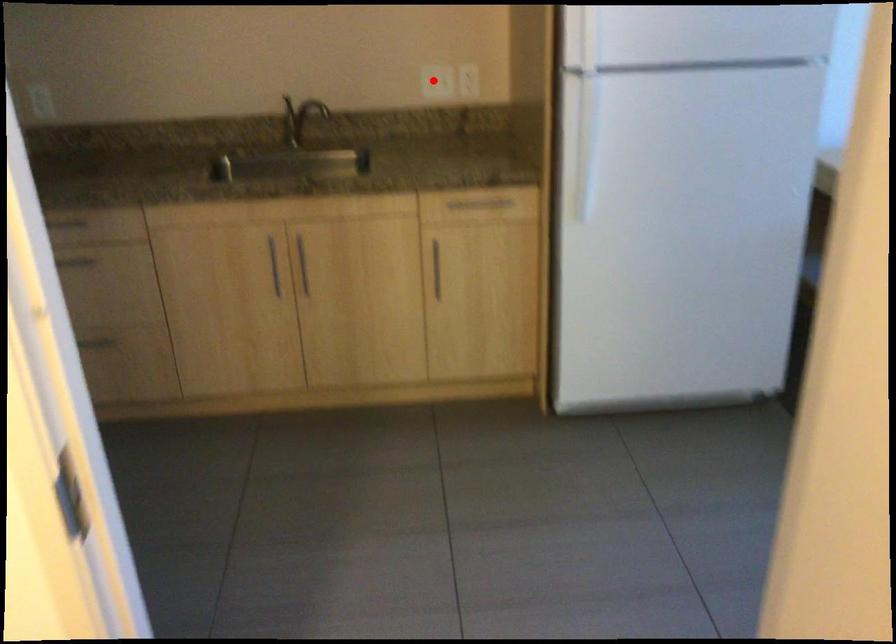
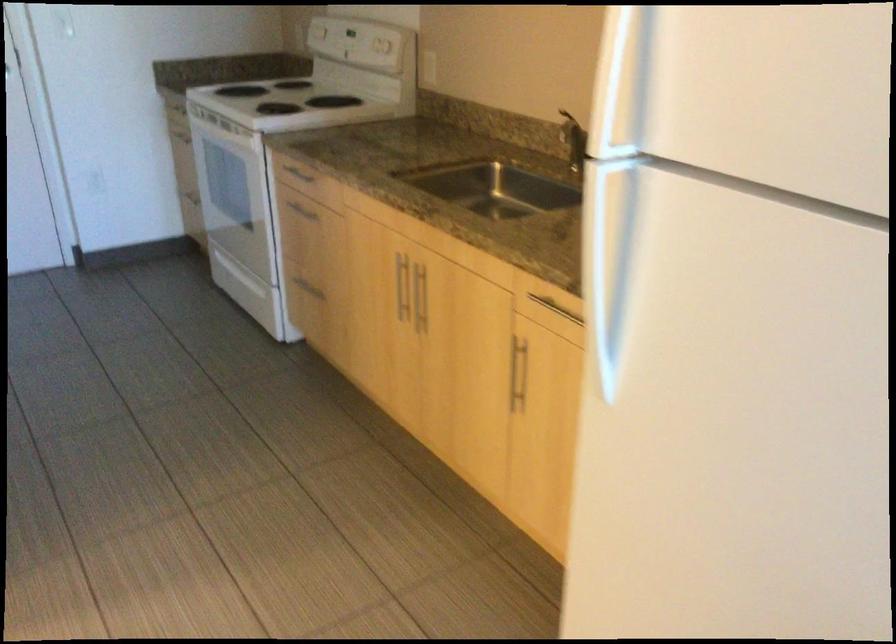
Question: I am providing you with two images of the same scene from different viewpoints. A red point is marked on the first image. Can you still see the location of the red point in image 2?

Choices:
 (A) Yes
 (B) No

Answer: (B)